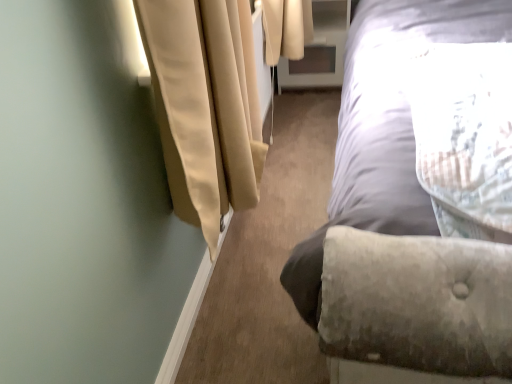
Question: Can we say velvet gray bed at right lies outside clear glass screen door at upper center?

Choices:
 (A) no
 (B) yes

Answer: (B)

Question: Is velvet gray bed at right positioned with its back to clear glass screen door at upper center?

Choices:
 (A) no
 (B) yes

Answer: (A)

Question: Is velvet gray bed at right far away from clear glass screen door at upper center?

Choices:
 (A) no
 (B) yes

Answer: (A)

Question: Is velvet gray bed at right aimed at clear glass screen door at upper center?

Choices:
 (A) yes
 (B) no

Answer: (B)

Question: Is velvet gray bed at right bigger than clear glass screen door at upper center?

Choices:
 (A) yes
 (B) no

Answer: (A)

Question: Is velvet gray bed at right taller than clear glass screen door at upper center?

Choices:
 (A) yes
 (B) no

Answer: (A)

Question: From a real-world perspective, is clear glass screen door at upper center located beneath velvet gray bed at right?

Choices:
 (A) no
 (B) yes

Answer: (B)

Question: From the image's perspective, would you say clear glass screen door at upper center is shown under velvet gray bed at right?

Choices:
 (A) yes
 (B) no

Answer: (B)

Question: Considering the relative positions of clear glass screen door at upper center and velvet gray bed at right in the image provided, is clear glass screen door at upper center to the left of velvet gray bed at right from the viewer's perspective?

Choices:
 (A) no
 (B) yes

Answer: (B)

Question: Is clear glass screen door at upper center wider than velvet gray bed at right?

Choices:
 (A) no
 (B) yes

Answer: (A)

Question: From the image's perspective, is clear glass screen door at upper center over velvet gray bed at right?

Choices:
 (A) yes
 (B) no

Answer: (A)

Question: Is clear glass screen door at upper center not within velvet gray bed at right?

Choices:
 (A) no
 (B) yes

Answer: (B)

Question: Does point (326, 1) appear closer or farther from the camera than point (387, 1)?

Choices:
 (A) closer
 (B) farther

Answer: (B)